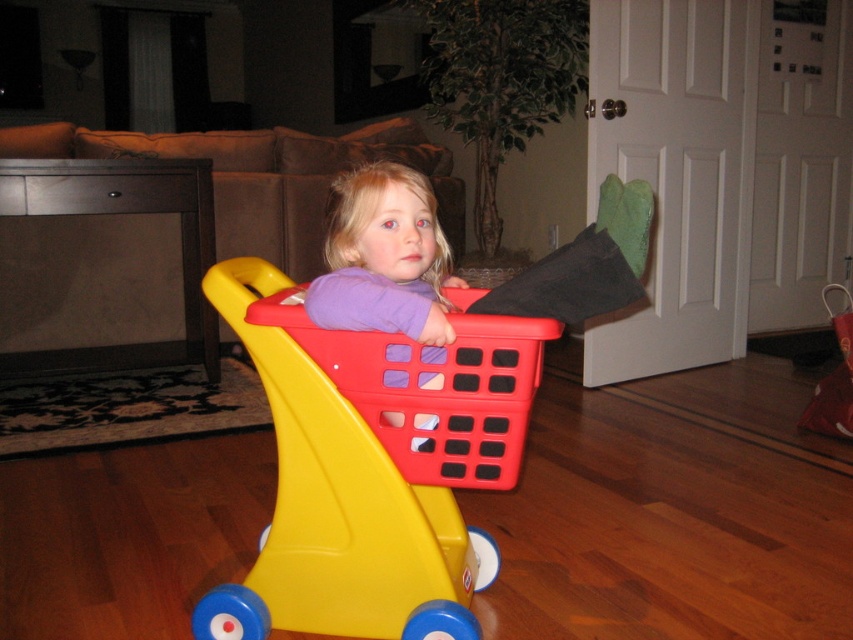
Can you confirm if matte plastic shopping cart at center is smaller than red plastic basket at center?

No.

Find the location of a particular element. Image resolution: width=853 pixels, height=640 pixels. matte plastic shopping cart at center is located at coordinates (370, 472).